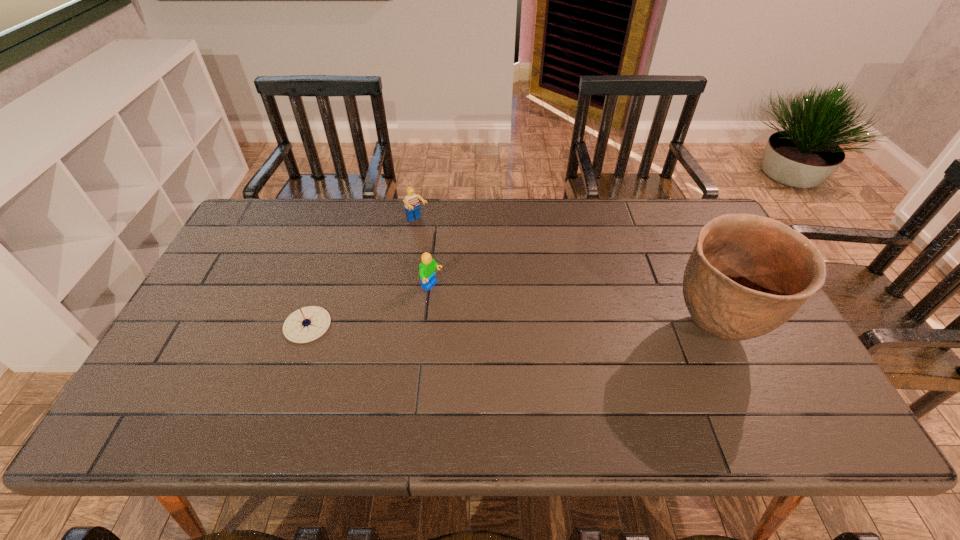
The width and height of the screenshot is (960, 540). In order to click on the shortest object in this screenshot , I will do `click(304, 325)`.

Identify the location of the leftmost object. The image size is (960, 540). (304, 325).

I want to click on the tallest object, so click(x=747, y=275).

Locate an element on the screen. The image size is (960, 540). pottery is located at coordinates (747, 275).

The height and width of the screenshot is (540, 960). What are the coordinates of `the farther Lego` in the screenshot? It's located at (412, 206).

Find the location of a particular element. the nearer Lego is located at coordinates (427, 267).

Locate an element on the screen. The height and width of the screenshot is (540, 960). free point located on the right of the compass is located at coordinates (475, 325).

You are a GUI agent. You are given a task and a screenshot of the screen. Output one action in this format:
    pyautogui.click(x=<x>, y=<y>)
    Task: Click on the free space located on the left of the pottery
    This screenshot has width=960, height=540.
    Given the screenshot: What is the action you would take?
    pyautogui.click(x=548, y=328)

Locate an element on the screen. The width and height of the screenshot is (960, 540). free space located 0.160m on the face of the farther Lego is located at coordinates (449, 256).

Locate an element on the screen. This screenshot has height=540, width=960. free point located on the face of the farther Lego is located at coordinates (494, 306).